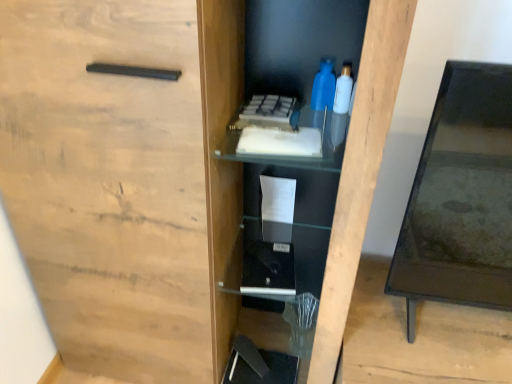
Question: Would you say blue plastic bottle at upper center, which appears as the 2th bottle when viewed from the right, is part of black glass table at right's contents?

Choices:
 (A) no
 (B) yes

Answer: (A)

Question: Is black glass table at right looking in the opposite direction of blue plastic bottle at upper center, which appears as the 2th bottle when viewed from the right?

Choices:
 (A) yes
 (B) no

Answer: (B)

Question: Does black glass table at right have a larger size compared to blue plastic bottle at upper center, arranged as the first bottle when viewed from the left?

Choices:
 (A) no
 (B) yes

Answer: (B)

Question: From a real-world perspective, is black glass table at right beneath blue plastic bottle at upper center, which appears as the 2th bottle when viewed from the right?

Choices:
 (A) no
 (B) yes

Answer: (B)

Question: Is black glass table at right shorter than blue plastic bottle at upper center, arranged as the first bottle when viewed from the left?

Choices:
 (A) yes
 (B) no

Answer: (B)

Question: Looking at their shapes, would you say translucent plastic bottle at upper right, placed as the second bottle when sorted from left to right, is wider or thinner than blue plastic bottle at upper center, which appears as the 2th bottle when viewed from the right?

Choices:
 (A) wide
 (B) thin

Answer: (A)

Question: From their relative heights in the image, would you say translucent plastic bottle at upper right, the 1th bottle viewed from the right, is taller or shorter than blue plastic bottle at upper center, arranged as the first bottle when viewed from the left?

Choices:
 (A) tall
 (B) short

Answer: (B)

Question: Is translucent plastic bottle at upper right, placed as the second bottle when sorted from left to right, to the left or to the right of blue plastic bottle at upper center, which appears as the 2th bottle when viewed from the right, in the image?

Choices:
 (A) right
 (B) left

Answer: (A)

Question: Does point (336, 104) appear closer or farther from the camera than point (318, 74)?

Choices:
 (A) closer
 (B) farther

Answer: (B)

Question: From a real-world perspective, is black glass table at right positioned above or below translucent plastic bottle at upper right, placed as the second bottle when sorted from left to right?

Choices:
 (A) above
 (B) below

Answer: (B)

Question: From the image's perspective, is black glass table at right positioned above or below translucent plastic bottle at upper right, the 1th bottle viewed from the right?

Choices:
 (A) below
 (B) above

Answer: (A)

Question: Is point (507, 241) closer or farther from the camera than point (336, 110)?

Choices:
 (A) farther
 (B) closer

Answer: (B)

Question: Is black glass table at right spatially inside translucent plastic bottle at upper right, placed as the second bottle when sorted from left to right, or outside of it?

Choices:
 (A) inside
 (B) outside

Answer: (B)

Question: Relative to translucent plastic bottle at upper right, the 1th bottle viewed from the right, is blue plastic bottle at upper center, which appears as the 2th bottle when viewed from the right, in front or behind?

Choices:
 (A) front
 (B) behind

Answer: (B)

Question: In terms of size, does blue plastic bottle at upper center, arranged as the first bottle when viewed from the left, appear bigger or smaller than translucent plastic bottle at upper right, the 1th bottle viewed from the right?

Choices:
 (A) small
 (B) big

Answer: (B)